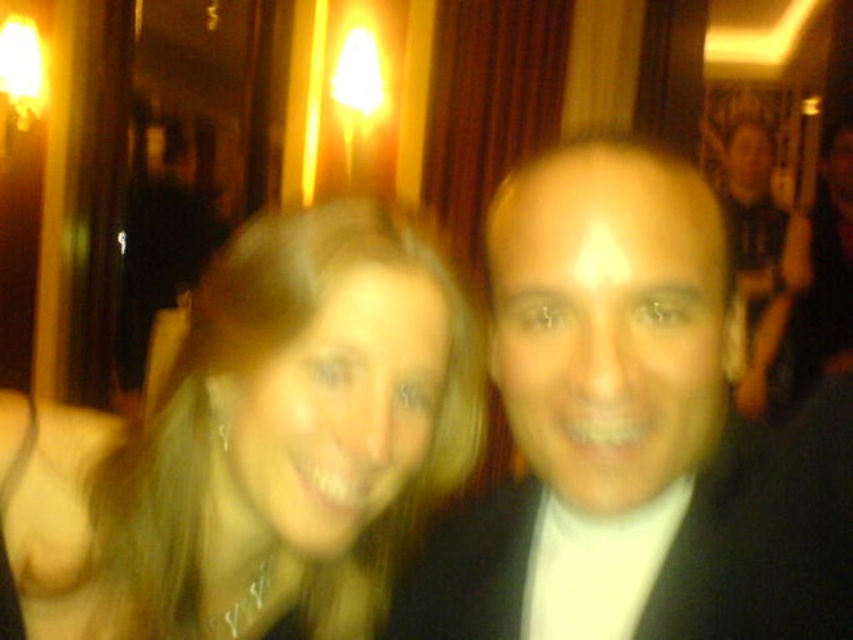
Can you confirm if blonde hair at center is positioned below black satin suit at upper right?

Yes, blonde hair at center is below black satin suit at upper right.

This screenshot has width=853, height=640. I want to click on blonde hair at center, so click(267, 432).